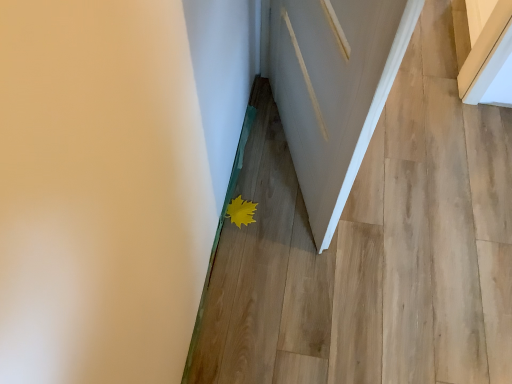
Identify the location of free space in front of white wood door at center. (311, 278).